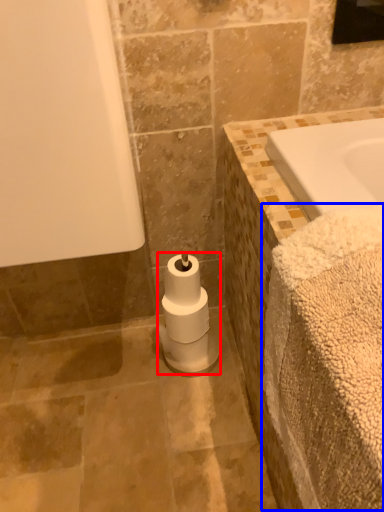
Question: Which object is closer to the camera taking this photo, toilet paper (highlighted by a red box) or bath towel (highlighted by a blue box)?

Choices:
 (A) toilet paper
 (B) bath towel

Answer: (B)